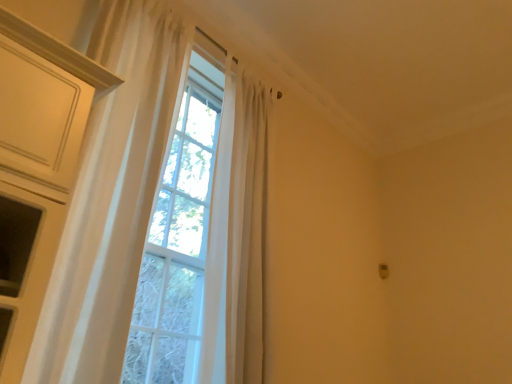
Describe the element at coordinates (111, 198) in the screenshot. I see `white sheer curtain at left` at that location.

Where is `white sheer curtain at left`? This screenshot has width=512, height=384. white sheer curtain at left is located at coordinates (111, 198).

What is the approximate height of white sheer curtain at left?

It is 6.26 feet.

This screenshot has height=384, width=512. I want to click on white sheer curtain at left, so click(111, 198).